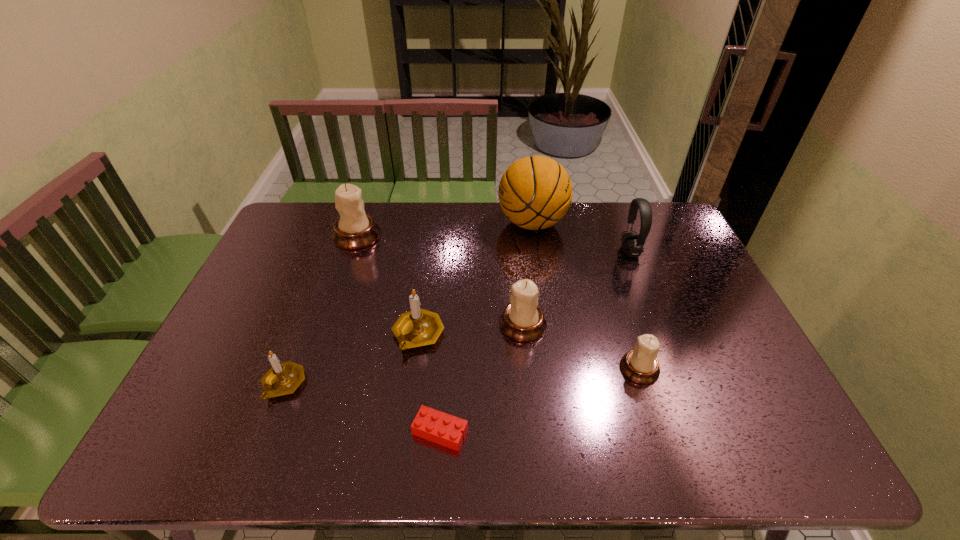
The width and height of the screenshot is (960, 540). What are the coordinates of `empty space that is in between the farthest candle holder and the fourth candle holder from left to right` in the screenshot? It's located at (440, 280).

The image size is (960, 540). I want to click on vacant area that lies between the nearest object and the second smallest white candle holder, so click(482, 378).

Identify the location of free area in between the rightmost candle holder and the left gold candle holder. (462, 376).

The height and width of the screenshot is (540, 960). In order to click on vacant space that is in between the basketball and the leftmost white candle holder in this screenshot , I will do `click(444, 230)`.

What are the coordinates of `object that stands as the fourth closest to the tallest candle holder` in the screenshot? It's located at (523, 320).

Locate which object ranks fourth in proximity to the second white candle holder from right to left. Please provide its 2D coordinates. Your answer should be formatted as a tuple, i.e. [(x, y)], where the tuple contains the x and y coordinates of a point satisfying the conditions above.

[(535, 192)]

Select which candle holder is the closest to the nearer gold candle holder. Please provide its 2D coordinates. Your answer should be formatted as a tuple, i.e. [(x, y)], where the tuple contains the x and y coordinates of a point satisfying the conditions above.

[(419, 327)]

Identify which candle holder is located as the second nearest to the rightmost object. Please provide its 2D coordinates. Your answer should be formatted as a tuple, i.e. [(x, y)], where the tuple contains the x and y coordinates of a point satisfying the conditions above.

[(640, 365)]

Locate an element on the screen. This screenshot has height=540, width=960. the second closest white candle holder to the second white candle holder from right to left is located at coordinates [x=354, y=229].

This screenshot has width=960, height=540. I want to click on white candle holder that is the closest one to the nearer gold candle holder, so click(354, 229).